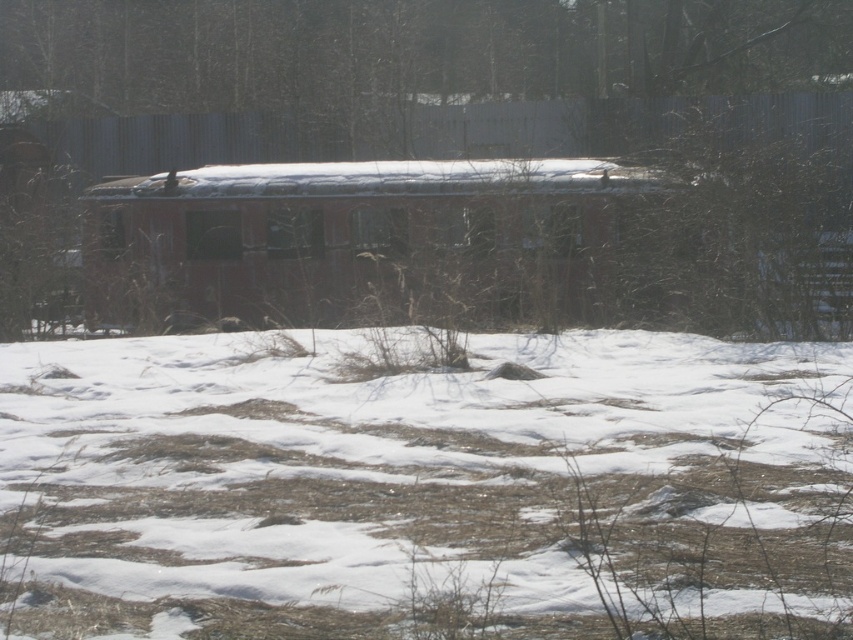
Question: Which point is closer to the camera?

Choices:
 (A) (119, 266)
 (B) (251, 554)
 (C) (370, 40)

Answer: (B)

Question: Which point is closer to the camera?

Choices:
 (A) white fluffy snow at lower center
 (B) brown textured fence at upper center
 (C) rusty metal train car at center

Answer: (A)

Question: Is rusty metal train car at center to the right of brown textured fence at upper center from the viewer's perspective?

Choices:
 (A) yes
 (B) no

Answer: (A)

Question: Which is farther from the brown textured fence at upper center?

Choices:
 (A) rusty metal train car at center
 (B) white fluffy snow at lower center

Answer: (B)

Question: In this image, where is rusty metal train car at center located relative to brown textured fence at upper center?

Choices:
 (A) right
 (B) left

Answer: (A)

Question: Is white fluffy snow at lower center to the left of brown textured fence at upper center from the viewer's perspective?

Choices:
 (A) no
 (B) yes

Answer: (A)